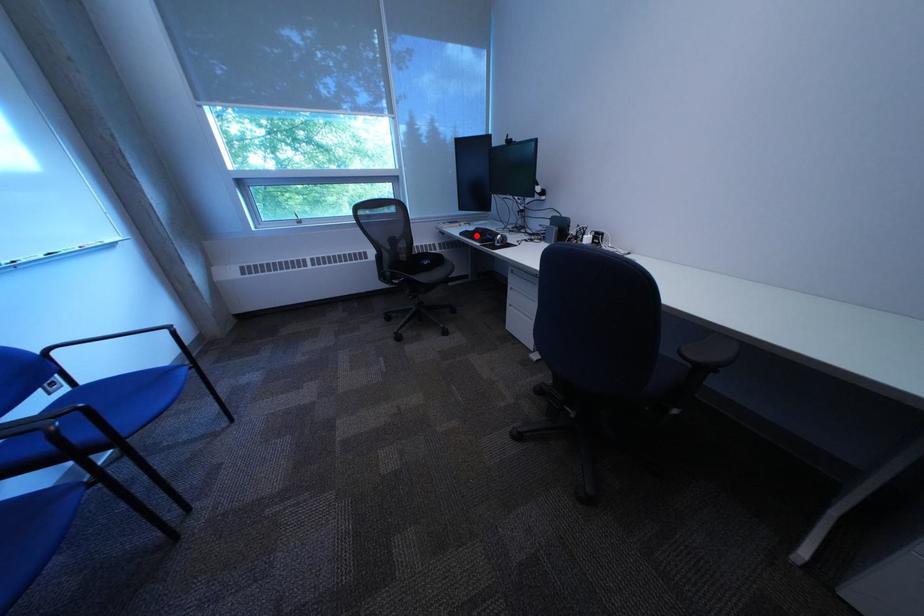
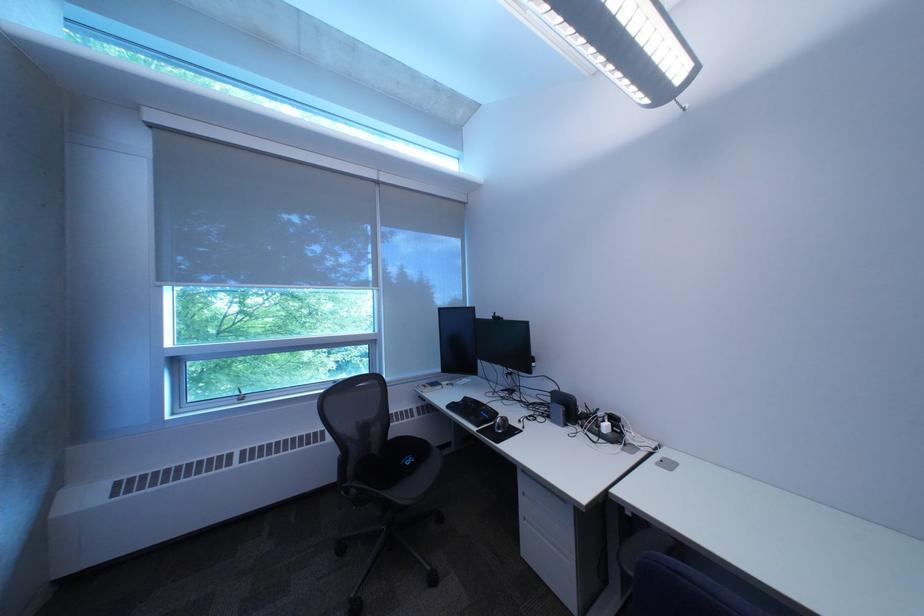
Question: I am providing you with two images of the same scene from different viewpoints. A red point is shown in image1. For the corresponding object point in image2, is it positioned nearer or farther from the camera?

Choices:
 (A) Nearer
 (B) Farther

Answer: (B)